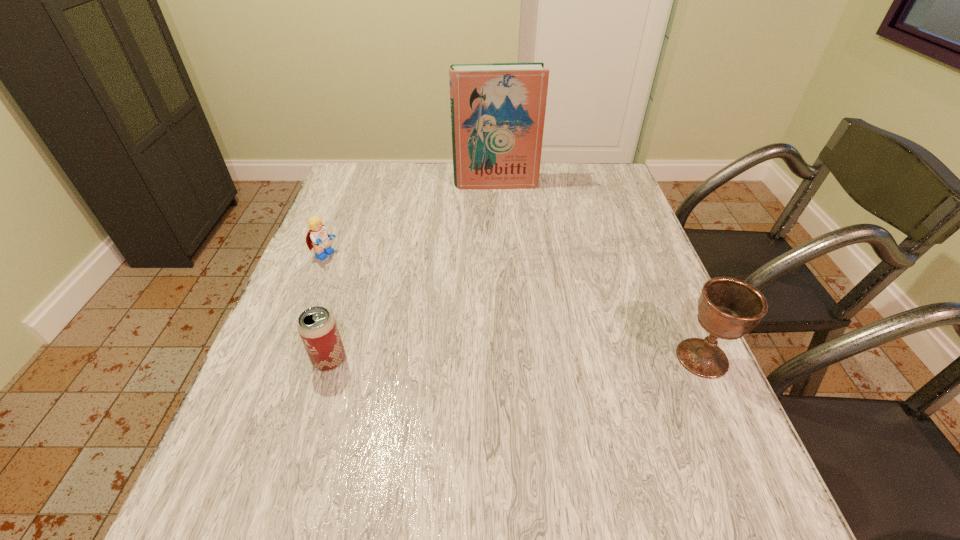
Where is `vacant space that satisfies the following two spatial constraints: 1. on the front side of the chalice; 2. on the left side of the hardback book`? vacant space that satisfies the following two spatial constraints: 1. on the front side of the chalice; 2. on the left side of the hardback book is located at coordinates (504, 358).

You are a GUI agent. You are given a task and a screenshot of the screen. Output one action in this format:
    pyautogui.click(x=<x>, y=<y>)
    Task: Click on the vacant space that satisfies the following two spatial constraints: 1. on the back side of the chalice; 2. on the left side of the beer can
    
    Given the screenshot: What is the action you would take?
    pyautogui.click(x=330, y=358)